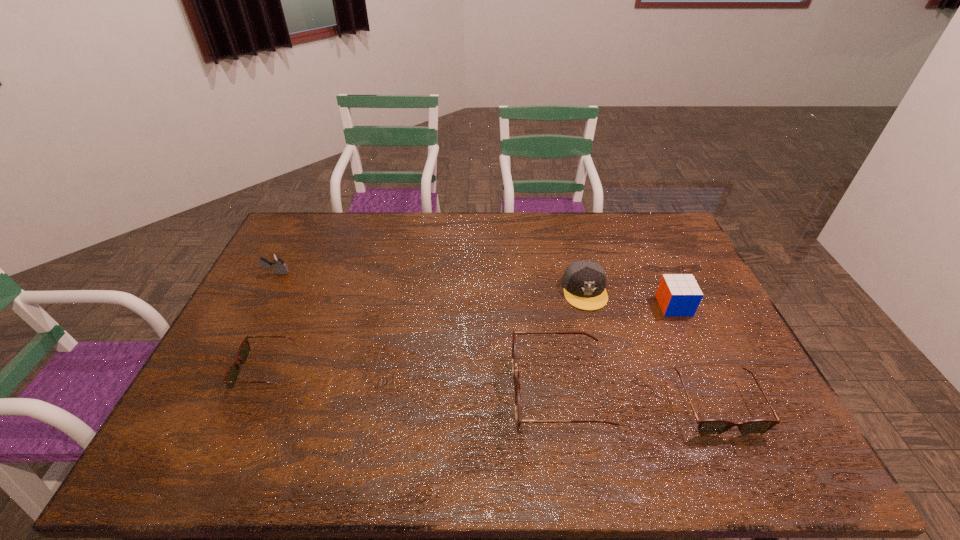
Locate an element on the screen. This screenshot has width=960, height=540. vacant area at the far edge is located at coordinates (380, 212).

In order to click on vacant space at the near edge of the desktop in this screenshot , I will do [x=438, y=425].

Find the location of a particular element. The width and height of the screenshot is (960, 540). vacant space at the right edge is located at coordinates (672, 319).

This screenshot has height=540, width=960. I want to click on vacant region at the near left corner, so click(x=187, y=423).

Locate an element on the screen. The height and width of the screenshot is (540, 960). free space at the far right corner is located at coordinates (662, 226).

Find the location of `vacant area that lies between the leftmost spectacles and the cap`. vacant area that lies between the leftmost spectacles and the cap is located at coordinates click(x=425, y=330).

You are a GUI agent. You are given a task and a screenshot of the screen. Output one action in this format:
    pyautogui.click(x=<x>, y=<y>)
    Task: Click on the free space between the leftmost spectacles and the igniter
    This screenshot has width=960, height=540.
    Given the screenshot: What is the action you would take?
    (x=271, y=321)

Locate an element on the screen. The image size is (960, 540). blank region between the igniter and the cube is located at coordinates [475, 289].

Identify the location of vacant area that lies between the rightmost spectacles and the cap. Image resolution: width=960 pixels, height=540 pixels. (650, 348).

At what (x,y) coordinates should I click in order to perform the action: click on free space between the second spectacles from right to left and the igniter. Please return your answer as a coordinate pair (x, y). Looking at the image, I should click on (418, 333).